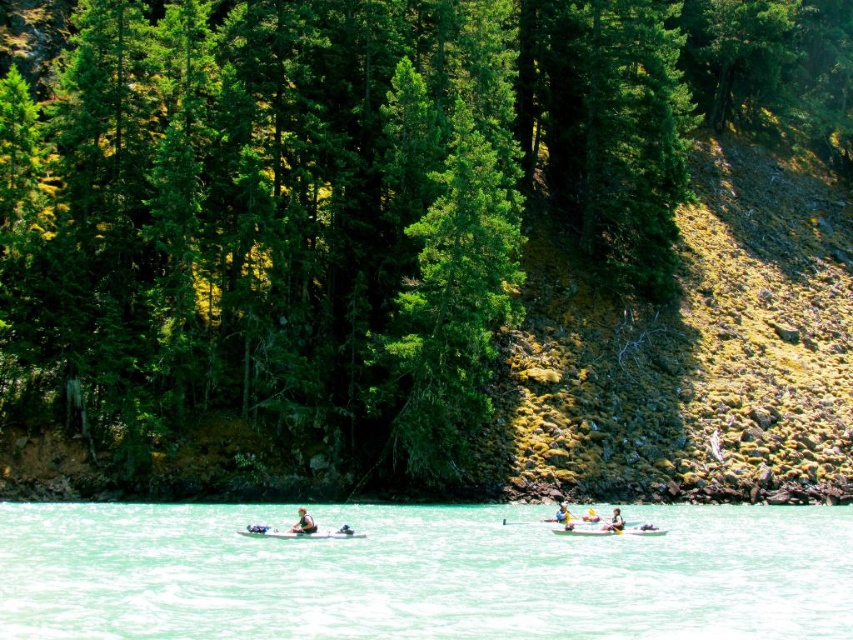
Question: Which of these objects is positioned farthest from the light brown wooden paddle at center?

Choices:
 (A) clear turquoise water at center
 (B) yellow plastic paddle at center
 (C) white fabric kayak at center
 (D) matte white kayak at center

Answer: (D)

Question: Which point is farther to the camera?

Choices:
 (A) (352, 611)
 (B) (585, 520)
 (C) (613, 522)
 (D) (564, 502)

Answer: (D)

Question: Which of the following is the closest to the observer?

Choices:
 (A) matte white kayak at center
 (B) yellow plastic paddle at center

Answer: (A)

Question: From the image, what is the correct spatial relationship of clear turquoise water at center in relation to yellow fabric kayak at center?

Choices:
 (A) right
 (B) left

Answer: (B)

Question: Does yellow plastic paddle at center have a larger size compared to white fabric kayak at center?

Choices:
 (A) no
 (B) yes

Answer: (A)

Question: Does matte white kayak at center appear on the left side of white fabric kayak at center?

Choices:
 (A) no
 (B) yes

Answer: (A)